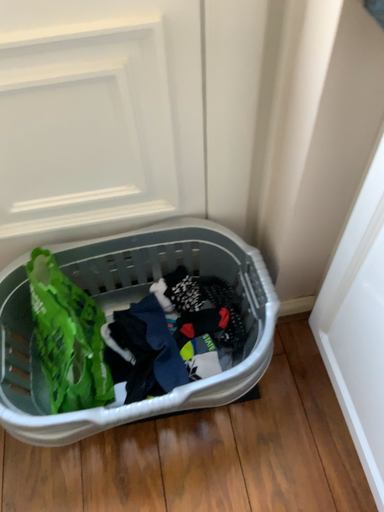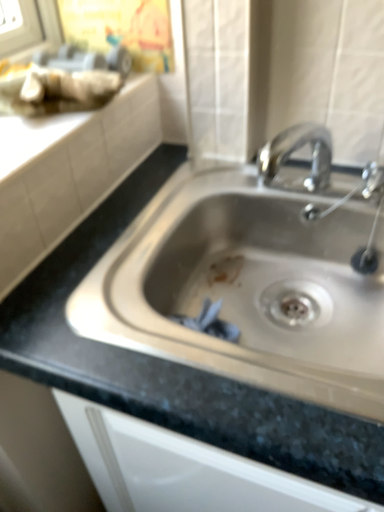
Question: Which way did the camera rotate in the video?

Choices:
 (A) rotated downward
 (B) rotated upward

Answer: (B)